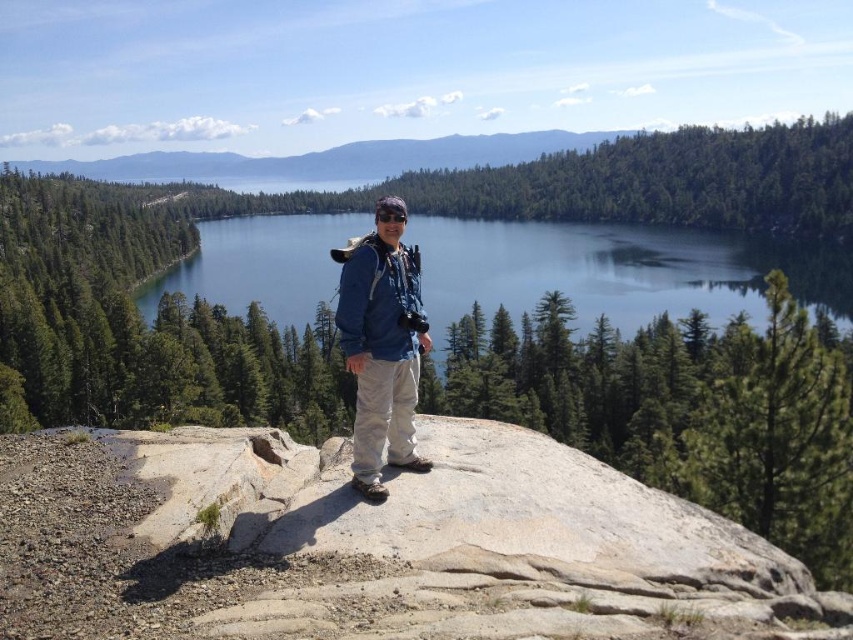
Is point (785, 637) closer to camera compared to point (367, 388)?

That is True.

Between gray granite rock at center and blue denim jacket at center, which one has more height?

With more height is blue denim jacket at center.

This screenshot has height=640, width=853. I want to click on gray granite rock at center, so click(x=374, y=545).

Where is `gray granite rock at center`? gray granite rock at center is located at coordinates (374, 545).

Between point (741, 291) and point (373, 481), which one is positioned in front?

Point (373, 481) is in front.

Does blue glassy water at center lie behind blue denim jacket at center?

Yes, blue glassy water at center is further from the viewer.

The width and height of the screenshot is (853, 640). In order to click on blue glassy water at center in this screenshot , I will do `click(618, 269)`.

Is gray granite rock at center positioned at the back of blue glassy water at center?

No, gray granite rock at center is closer to the viewer.

Can you confirm if gray granite rock at center is bigger than blue glassy water at center?

No.

Is point (317, 492) positioned behind point (184, 264)?

No, (317, 492) is in front of (184, 264).

Identify the location of gray granite rock at center. This screenshot has height=640, width=853. (374, 545).